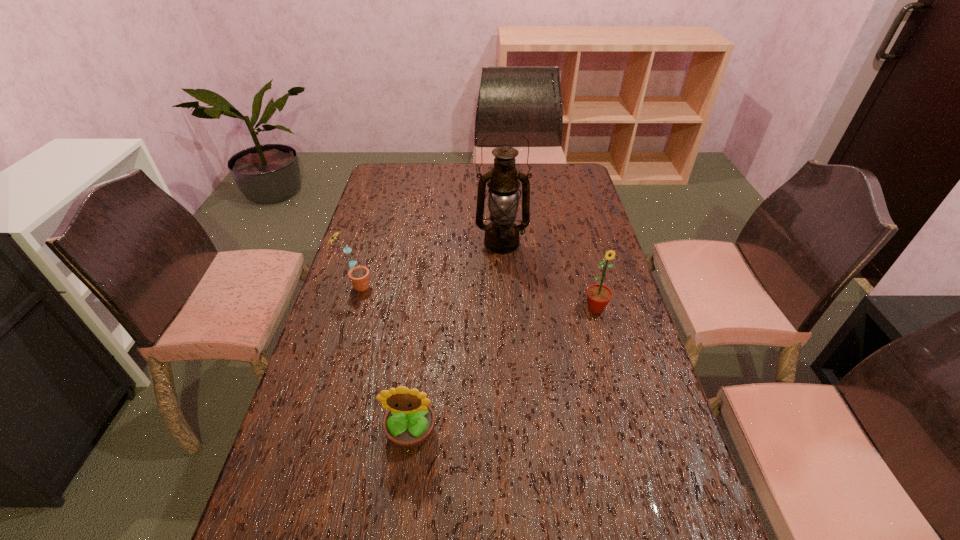
At what (x,y) coordinates should I click in order to perform the action: click on blank area located 0.240m on the flower of the farthest sunflower. Please return your answer as a coordinate pair (x, y). The height and width of the screenshot is (540, 960). Looking at the image, I should click on (447, 286).

Identify the location of blank space located on the face of the second sunflower from right to left. The image size is (960, 540). (404, 482).

The height and width of the screenshot is (540, 960). What are the coordinates of `object that is positioned at the left edge` in the screenshot? It's located at (359, 275).

The image size is (960, 540). What are the coordinates of `object located at the right edge` in the screenshot? It's located at (598, 296).

In order to click on vacant space at the left edge of the desktop in this screenshot , I will do `click(364, 227)`.

What are the coordinates of `vacant region at the right edge of the desktop` in the screenshot? It's located at (664, 442).

Image resolution: width=960 pixels, height=540 pixels. What are the coordinates of `free space that is in between the shortest sunflower and the oil lamp` in the screenshot? It's located at (456, 338).

Where is `unoccupied area between the shortest object and the tallest object`? Image resolution: width=960 pixels, height=540 pixels. unoccupied area between the shortest object and the tallest object is located at coordinates (456, 338).

Find the location of a particular element. This screenshot has width=960, height=540. vacant space that's between the oil lamp and the rightmost object is located at coordinates (549, 276).

Locate which object is the third closest to the rightmost object. Please provide its 2D coordinates. Your answer should be formatted as a tuple, i.e. [(x, y)], where the tuple contains the x and y coordinates of a point satisfying the conditions above.

[(359, 275)]